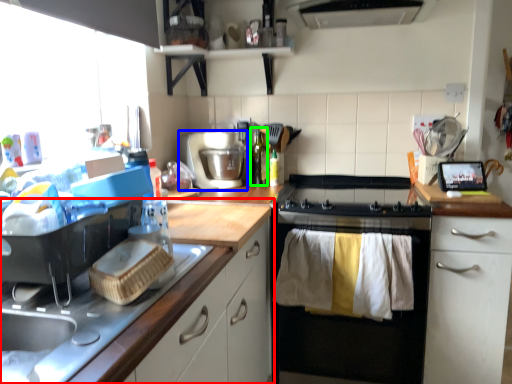
Question: Considering the real-world distances, which object is closest to cabinetry (highlighted by a red box)? kitchen appliance (highlighted by a blue box) or bottle (highlighted by a green box).

Choices:
 (A) kitchen appliance
 (B) bottle

Answer: (A)